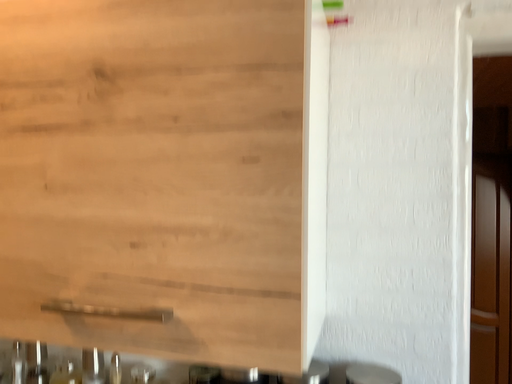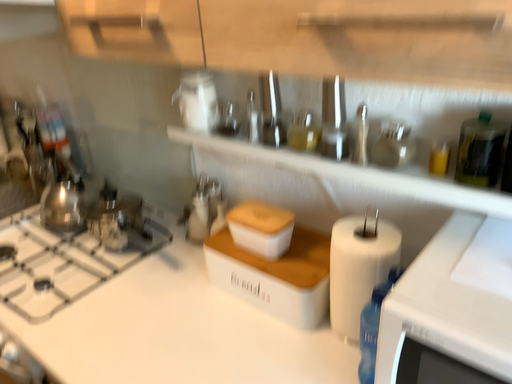
Question: How did the camera likely rotate when shooting the video?

Choices:
 (A) rotated upward
 (B) rotated downward

Answer: (B)